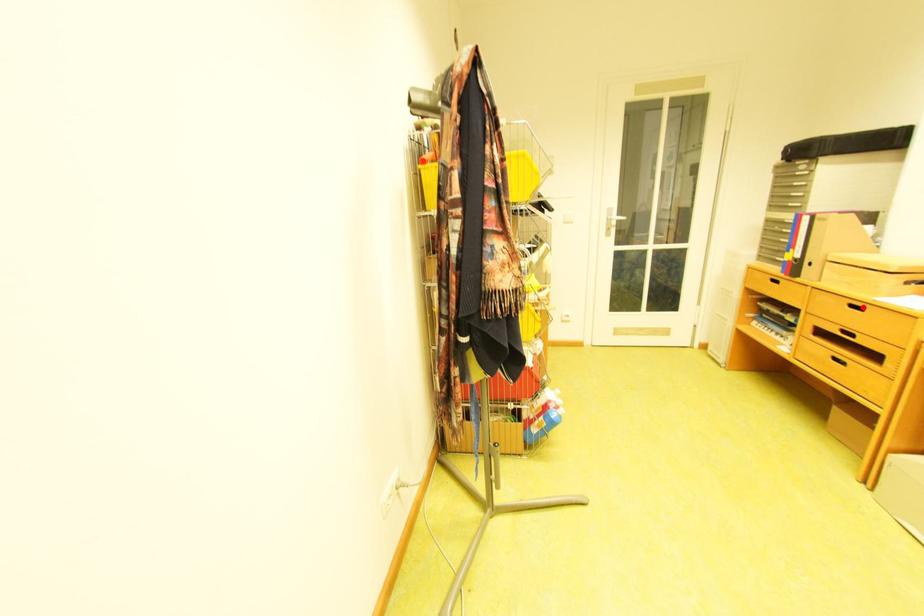
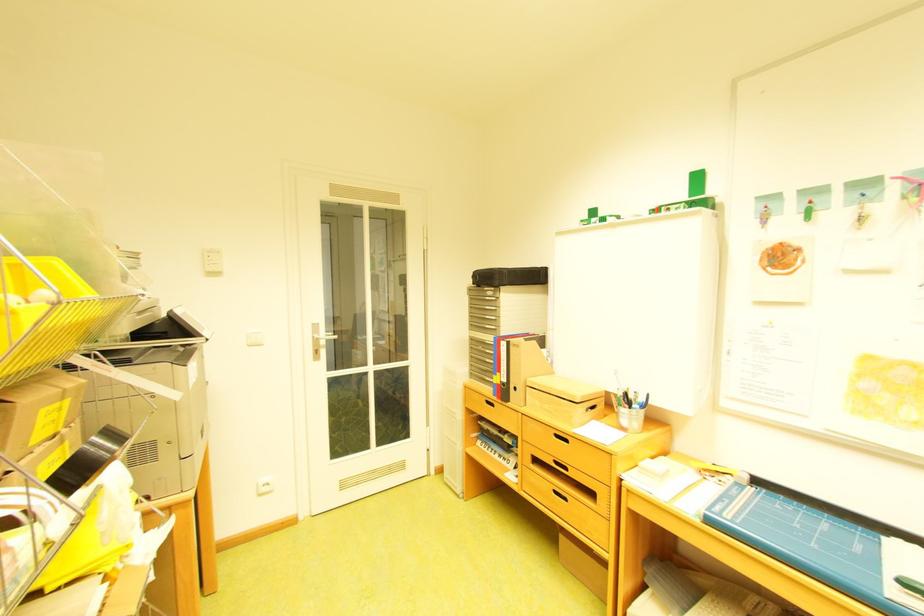
Locate, in the second image, the point that corresponds to the highlighted location in the first image.

(568, 437)